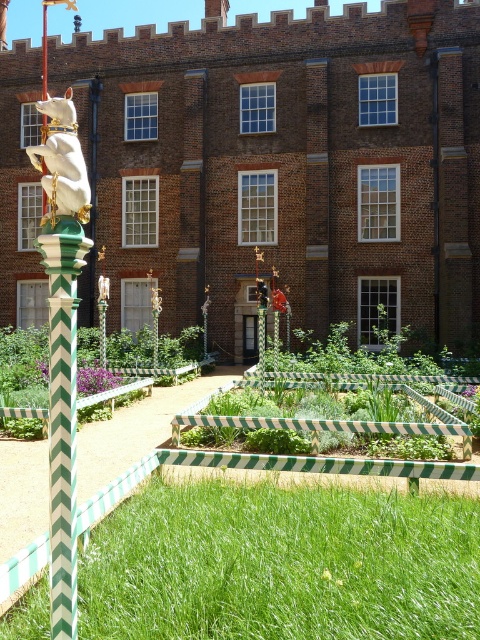
Can you confirm if green striped pole at left is shorter than white glossy statue at left?

Correct, green striped pole at left is not as tall as white glossy statue at left.

Identify the location of green striped pole at left. (62, 413).

Identify the location of green striped pole at left. (62, 413).

Who is lower down, green striped planter at center or white glossy statue at left?

green striped planter at center

How much distance is there between green striped planter at center and white glossy statue at left?

green striped planter at center and white glossy statue at left are 9.53 feet apart.

The width and height of the screenshot is (480, 640). What do you see at coordinates (282, 568) in the screenshot?
I see `green striped planter at center` at bounding box center [282, 568].

At what (x,y) coordinates should I click in order to perform the action: click on green striped planter at center. Please return your answer as a coordinate pair (x, y). Looking at the image, I should click on tap(282, 568).

Does green striped planter at center appear on the left side of green striped pole at left?

Incorrect, green striped planter at center is not on the left side of green striped pole at left.

Does point (279, 568) lie behind point (72, 472)?

Yes, it is behind point (72, 472).

Identify the location of green striped planter at center. The image size is (480, 640). (282, 568).